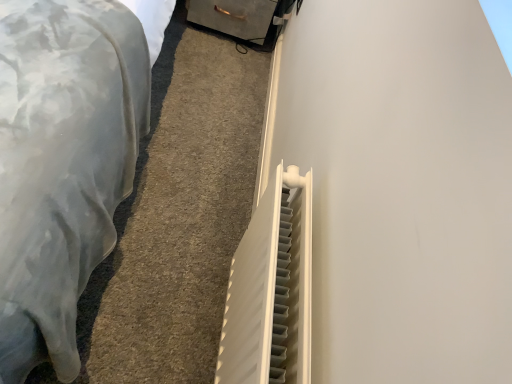
This screenshot has width=512, height=384. Find the location of `free space to the left of white plastic radiator at center-right`. free space to the left of white plastic radiator at center-right is located at coordinates (148, 304).